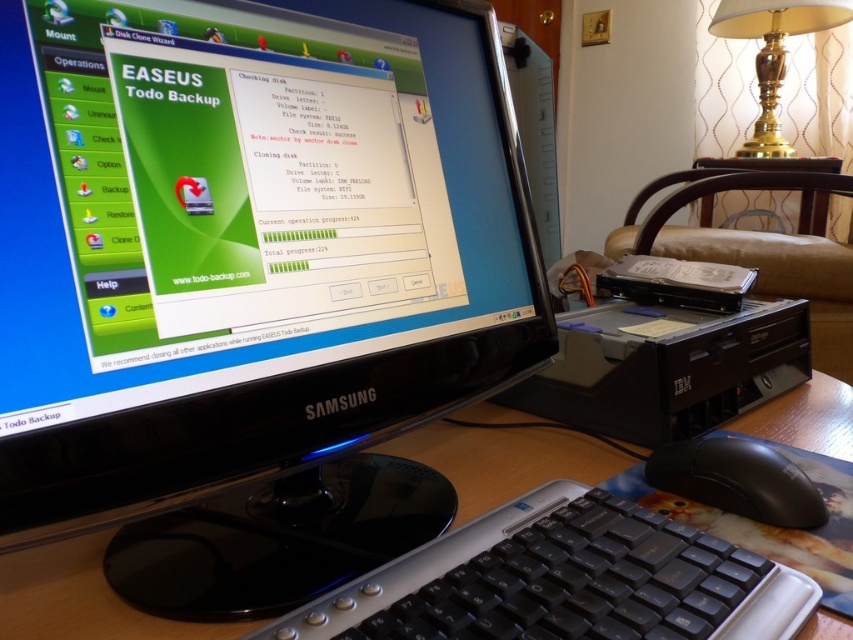
Can you confirm if black plastic monitor at center is wider than black plastic keyboard at center?

Incorrect, black plastic monitor at center's width does not surpass black plastic keyboard at center's.

Is point (426, 536) less distant than point (531, 595)?

No, it is behind (531, 595).

At what (x,y) coordinates should I click in order to perform the action: click on black plastic monitor at center. Please return your answer as a coordinate pair (x, y). Image resolution: width=853 pixels, height=640 pixels. Looking at the image, I should click on tap(252, 269).

Is black plastic keyboard at center below black matte mouse at lower right?

Yes.

Between black plastic keyboard at center and black matte mouse at lower right, which one appears on the left side from the viewer's perspective?

black plastic keyboard at center

You are a GUI agent. You are given a task and a screenshot of the screen. Output one action in this format:
    pyautogui.click(x=<x>, y=<y>)
    Task: Click on the black plastic keyboard at center
    
    Given the screenshot: What is the action you would take?
    pyautogui.click(x=563, y=580)

You are a GUI agent. You are given a task and a screenshot of the screen. Output one action in this format:
    pyautogui.click(x=<x>, y=<y>)
    Task: Click on the black plastic keyboard at center
    The width and height of the screenshot is (853, 640).
    Given the screenshot: What is the action you would take?
    pyautogui.click(x=563, y=580)

Who is positioned more to the left, black plastic monitor at center or black matte mouse at lower right?

black plastic monitor at center

Can you confirm if black plastic monitor at center is positioned above black matte mouse at lower right?

Yes.

Locate an element on the screen. black plastic monitor at center is located at coordinates (252, 269).